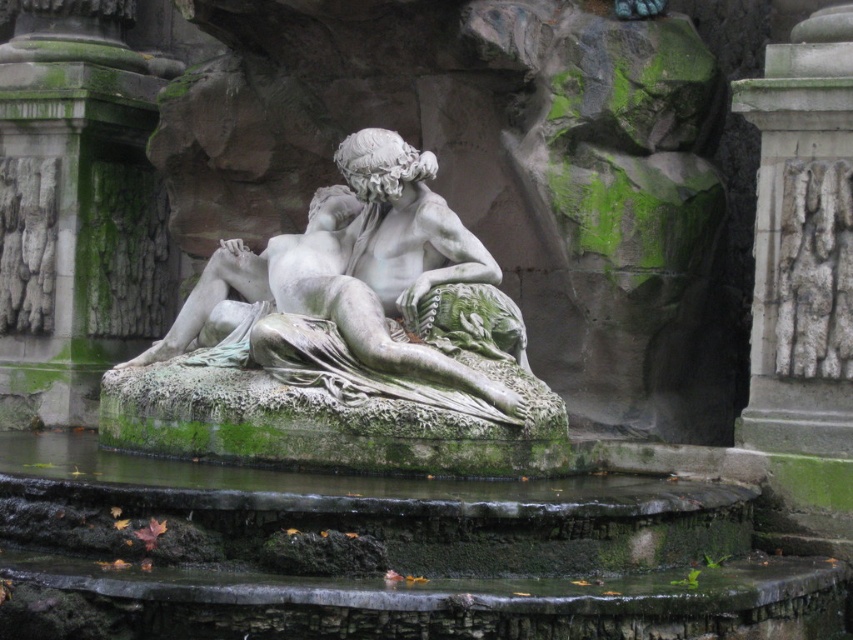
You are standing in front of the classical marble statue in the fountain. There are two points marked on the statue. One is at coordinate point (88, 300) and the other is at point (781, 227). Which point is closer to you?

Point (781, 227) is closer to you because it is in front of point (88, 300).

Based on the coordinates provided, where is the white marble statue at center located in the image?

The white marble statue at center is located at the coordinates point [361,296].